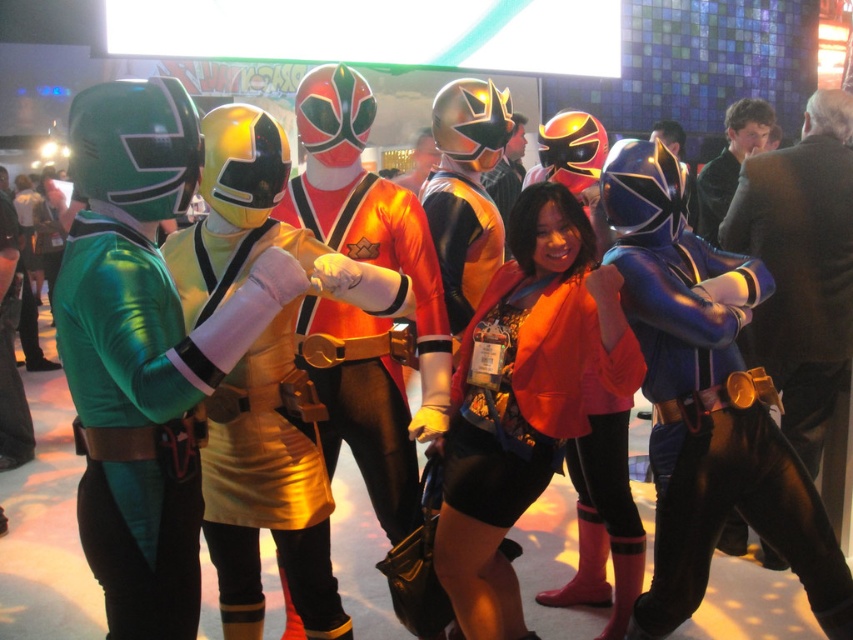
You are a photographer at the event and want to capture a photo where the matte orange jacket at center is positioned to the left of the shiny orange costume at center. Based on the current arrangement, is this possible without moving any objects?

The matte orange jacket at center is currently to the right of the shiny orange costume at center, so to have the matte orange jacket at center positioned to the left of the shiny orange costume at center, you would need to adjust their positions since they are currently in the opposite arrangement.

In the scene shown: You are standing at the entrance of the convention hall and want to locate the matte orange jacket at center. According to the coordinates provided, where should you look?

The matte orange jacket at center is located at coordinates point (524, 400).

You are a photographer at the event and need to position yourself so that both the matte orange jacket at center and the shiny orange costume at center are visible in your shot. Given their height difference, which one might block the view of the other?

The shiny orange costume at center is taller than the matte orange jacket at center, so if positioned between the photographer and the jacket, it could block the view of the matte orange jacket at center.